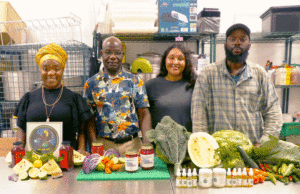
Identify the location of chopping board. (141, 173).